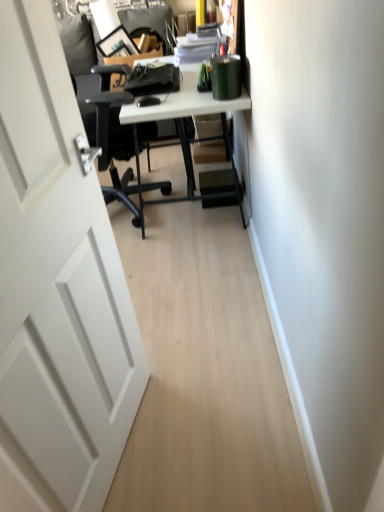
This screenshot has height=512, width=384. I want to click on free space in front of white glossy desk at center, so click(181, 272).